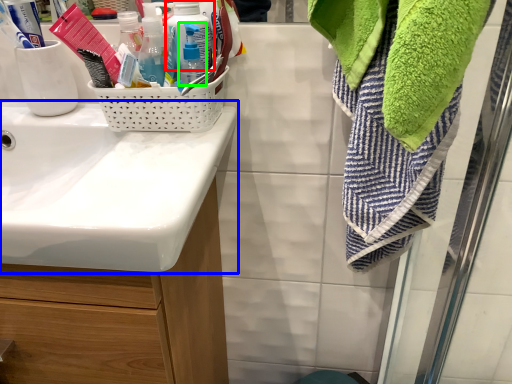
Question: Which object is the closest to the bottle (highlighted by a red box)? Choose among these: sink (highlighted by a blue box) or bottle (highlighted by a green box).

Choices:
 (A) sink
 (B) bottle

Answer: (B)